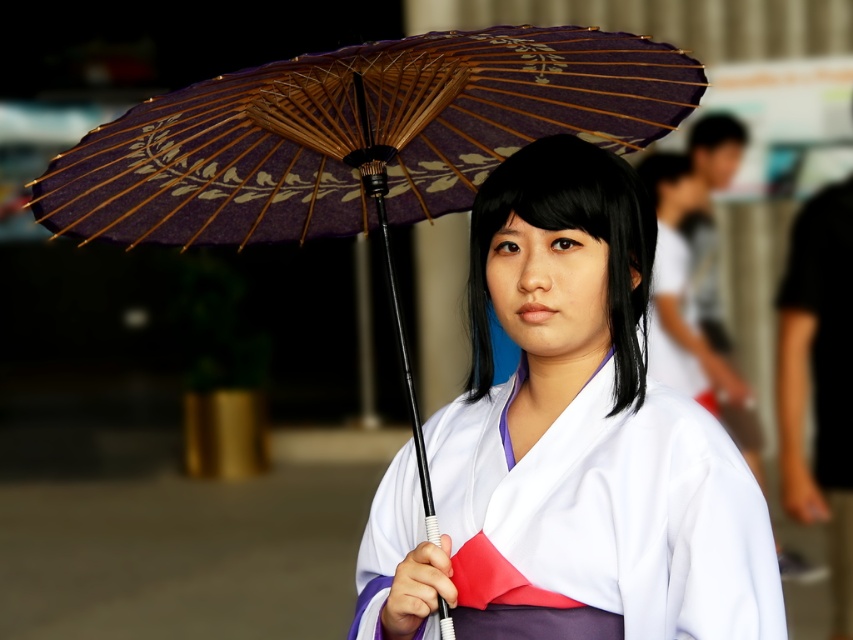
Question: Is matte purple kimono at center wider than black matte hair at center?

Choices:
 (A) no
 (B) yes

Answer: (B)

Question: Which point appears closest to the camera in this image?

Choices:
 (A) [x=720, y=636]
 (B) [x=610, y=205]
 (C) [x=700, y=189]
 (D) [x=726, y=128]

Answer: (A)

Question: Is black matte hair at center to the right of smooth skin head at upper right from the viewer's perspective?

Choices:
 (A) no
 (B) yes

Answer: (A)

Question: Which point is closer to the camera?

Choices:
 (A) (730, 138)
 (B) (625, 477)
 (C) (534, 184)
 (D) (674, 209)

Answer: (B)

Question: Can you confirm if matte purple kimono at center is wider than black matte hair at center?

Choices:
 (A) yes
 (B) no

Answer: (A)

Question: Among these points, which one is farthest from the camera?

Choices:
 (A) (659, 186)
 (B) (729, 138)
 (C) (547, 321)

Answer: (B)